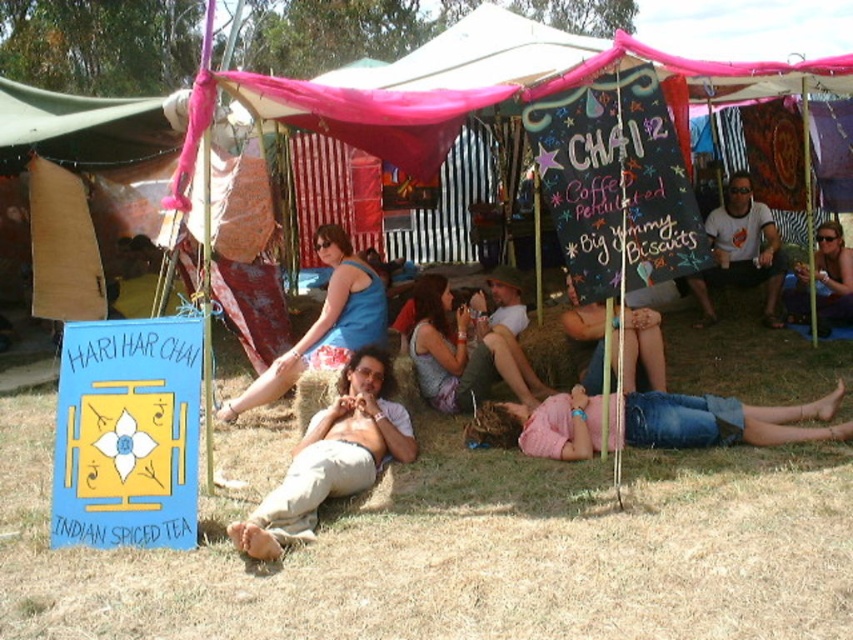
Question: Which point appears closest to the camera in this image?

Choices:
 (A) (398, 420)
 (B) (334, 362)

Answer: (A)

Question: Which point is farther to the camera?

Choices:
 (A) (347, 262)
 (B) (741, 193)
 (C) (171, 552)
 (D) (450, 333)

Answer: (B)

Question: In this image, where is denim shorts at center located relative to white t-shirt at center?

Choices:
 (A) above
 (B) below

Answer: (B)

Question: Is brown dry grass at lower center wider than white t-shirt at center?

Choices:
 (A) yes
 (B) no

Answer: (A)

Question: Can you confirm if brown dry grass at lower center is positioned to the right of white t-shirt at center?

Choices:
 (A) yes
 (B) no

Answer: (B)

Question: Which of the following is the farthest from the observer?

Choices:
 (A) (462, 392)
 (B) (321, 328)
 (C) (849, 588)

Answer: (A)